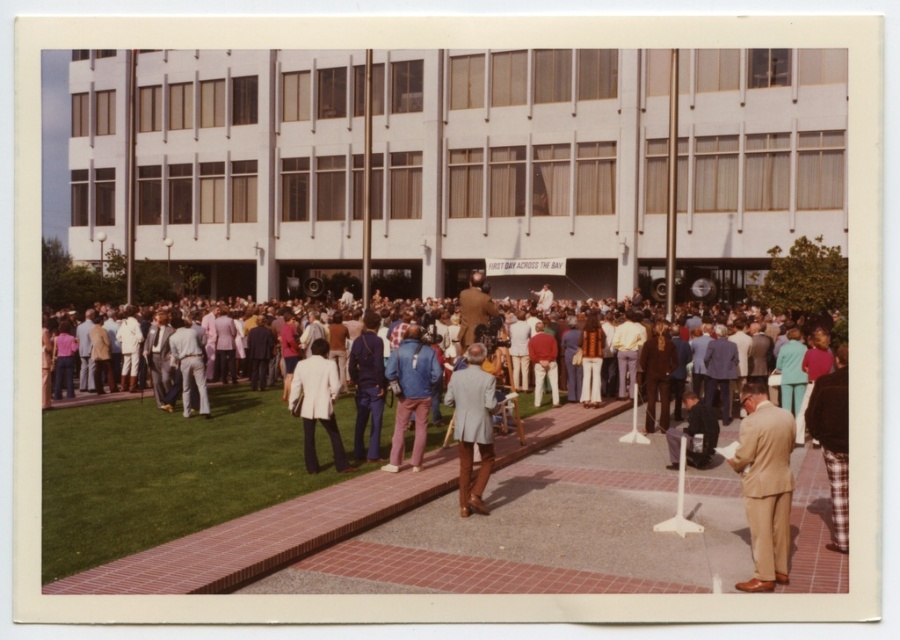
Question: Which point appears closest to the camera in this image?

Choices:
 (A) (760, 387)
 (B) (468, 301)
 (C) (698, 451)
 (D) (266, 352)

Answer: (A)

Question: Is tan suit at lower right closer to camera compared to white textured blazer at center?

Choices:
 (A) no
 (B) yes

Answer: (B)

Question: Can you confirm if tan suit at lower right is positioned to the right of white textured blazer at center?

Choices:
 (A) no
 (B) yes

Answer: (B)

Question: Is multicolored casual attire at center further to the viewer compared to white textured blazer at center?

Choices:
 (A) yes
 (B) no

Answer: (A)

Question: Which point appears farthest from the camera in this image?

Choices:
 (A) [x=707, y=438]
 (B) [x=165, y=342]
 (C) [x=781, y=480]
 (D) [x=304, y=401]

Answer: (B)

Question: Among these objects, which one is nearest to the camera?

Choices:
 (A) dark blue suit at center
 (B) light gray suit at center
 (C) white textured blazer at center
 (D) multicolored casual attire at center

Answer: (B)